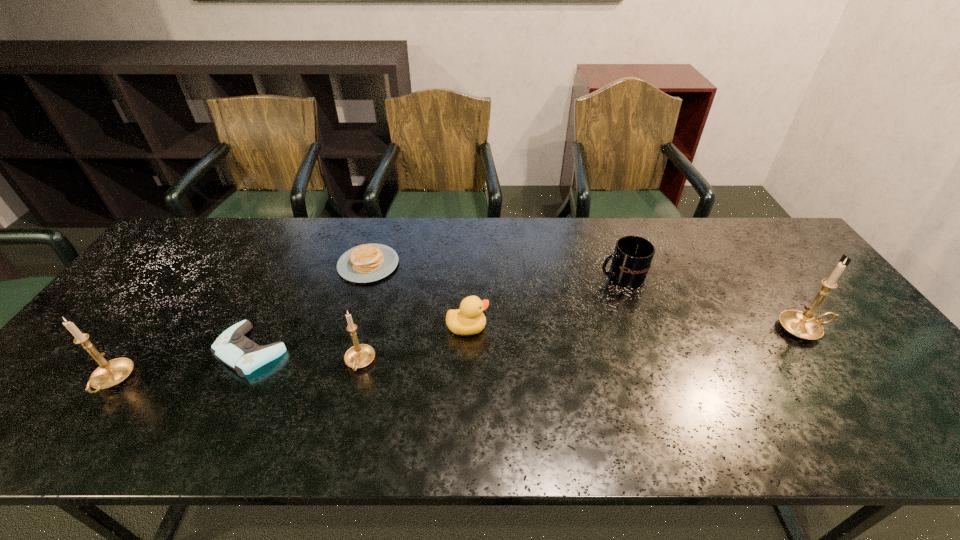
To make them evenly spaced by inserting another candle_holder among them, please locate a free space for this new candle_holder. Please provide its 2D coordinates. Your answer should be formatted as a tuple, i.e. [(x, y)], where the tuple contains the x and y coordinates of a point satisfying the conditions above.

[(589, 346)]